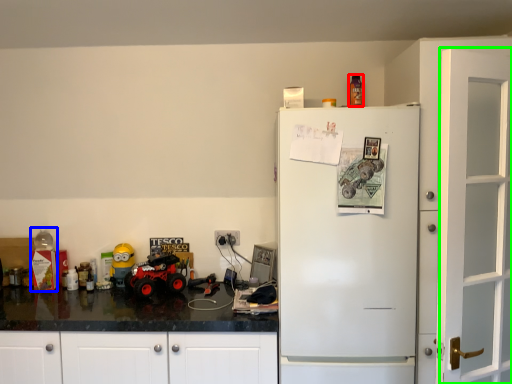
Question: Estimate the real-world distances between objects in this image. Which object is farther from toy (highlighted by a red box), toy (highlighted by a blue box) or door (highlighted by a green box)?

Choices:
 (A) toy
 (B) door

Answer: (A)